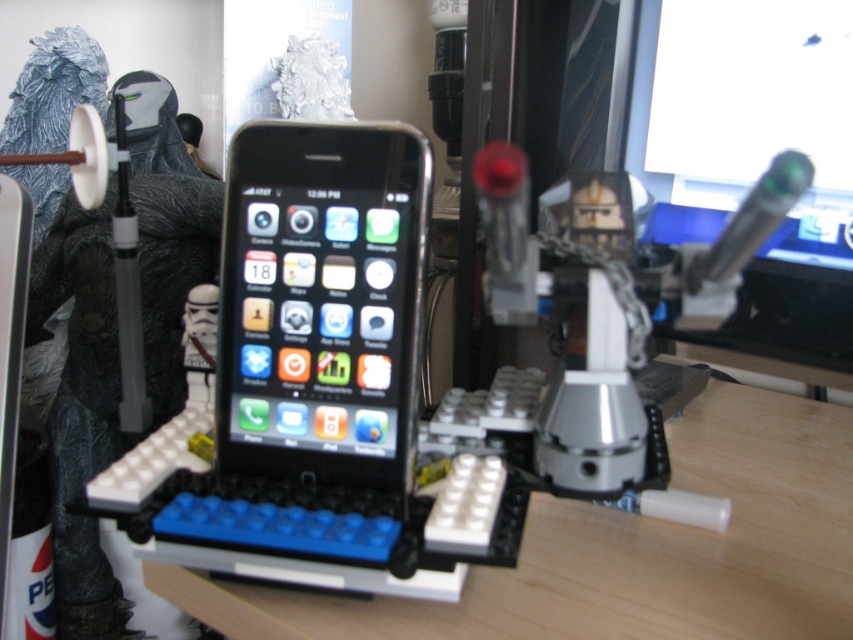
Question: Considering the real-world distances, which object is closest to the matte black monitor at upper right?

Choices:
 (A) wooden table at center
 (B) black glossy smartphone at center

Answer: (A)

Question: Estimate the real-world distances between objects in this image. Which object is closer to the matte black monitor at upper right?

Choices:
 (A) black glossy smartphone at center
 (B) wooden table at center

Answer: (B)

Question: Which point appears farthest from the camera in this image?

Choices:
 (A) (368, 378)
 (B) (698, 212)
 (C) (795, 472)

Answer: (B)

Question: Can you confirm if wooden table at center is positioned above black glossy smartphone at center?

Choices:
 (A) yes
 (B) no

Answer: (B)

Question: Does wooden table at center appear on the left side of black glossy smartphone at center?

Choices:
 (A) yes
 (B) no

Answer: (B)

Question: Does wooden table at center appear on the right side of black glossy smartphone at center?

Choices:
 (A) yes
 (B) no

Answer: (A)